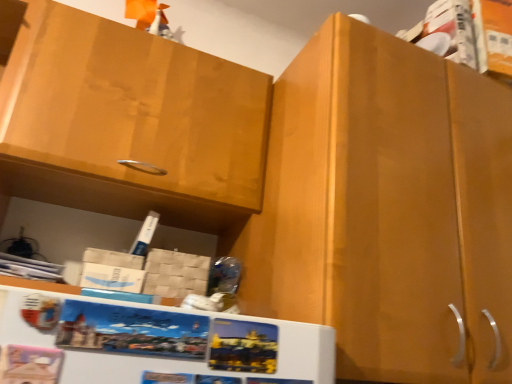
Question: Considering the positions of matte wood cabinet at center, which appears as the 2th cabinetry when viewed from the left, and matte wood cabinet at upper left, marked as the second cabinetry in a right-to-left arrangement, in the image, is matte wood cabinet at center, which appears as the 2th cabinetry when viewed from the left, taller or shorter than matte wood cabinet at upper left, marked as the second cabinetry in a right-to-left arrangement,?

Choices:
 (A) tall
 (B) short

Answer: (A)

Question: Relative to matte wood cabinet at upper left, marked as the 1th cabinetry in a left-to-right arrangement, is matte wood cabinet at center, which ranks as the 1th cabinetry in right-to-left order, in front or behind?

Choices:
 (A) behind
 (B) front

Answer: (B)

Question: Looking at their shapes, would you say matte wood cabinet at center, which ranks as the 1th cabinetry in right-to-left order, is wider or thinner than matte wood cabinet at upper left, marked as the 1th cabinetry in a left-to-right arrangement?

Choices:
 (A) wide
 (B) thin

Answer: (A)

Question: From the image's perspective, is matte wood cabinet at upper left, marked as the 1th cabinetry in a left-to-right arrangement, positioned above or below matte wood cabinet at center, which appears as the 2th cabinetry when viewed from the left?

Choices:
 (A) below
 (B) above

Answer: (B)

Question: Considering their positions, is matte wood cabinet at upper left, marked as the 1th cabinetry in a left-to-right arrangement, located in front of or behind matte wood cabinet at center, which ranks as the 1th cabinetry in right-to-left order?

Choices:
 (A) front
 (B) behind

Answer: (B)

Question: Is point (116, 137) closer or farther from the camera than point (455, 130)?

Choices:
 (A) farther
 (B) closer

Answer: (A)

Question: Based on their sizes in the image, would you say matte wood cabinet at upper left, marked as the second cabinetry in a right-to-left arrangement, is bigger or smaller than matte wood cabinet at center, which appears as the 2th cabinetry when viewed from the left?

Choices:
 (A) big
 (B) small

Answer: (B)